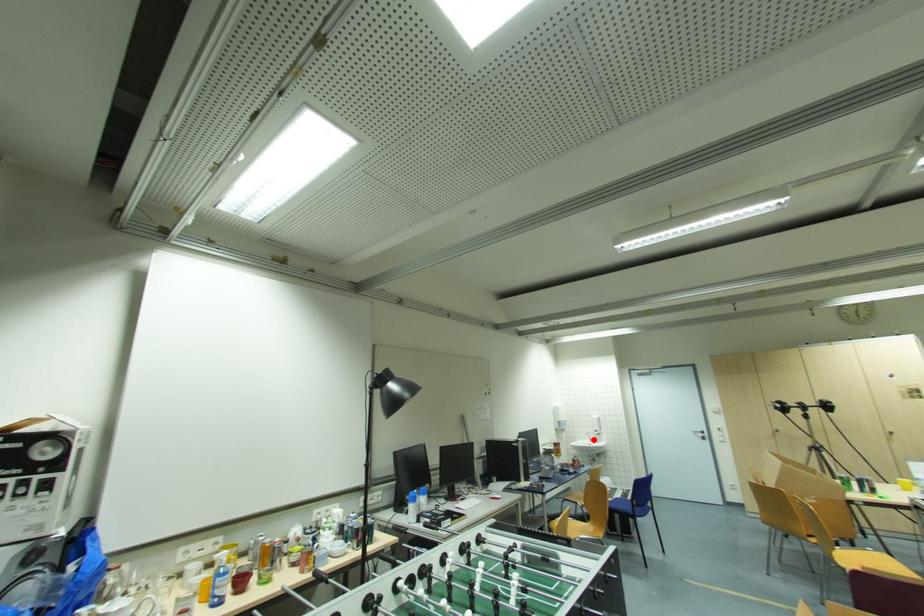
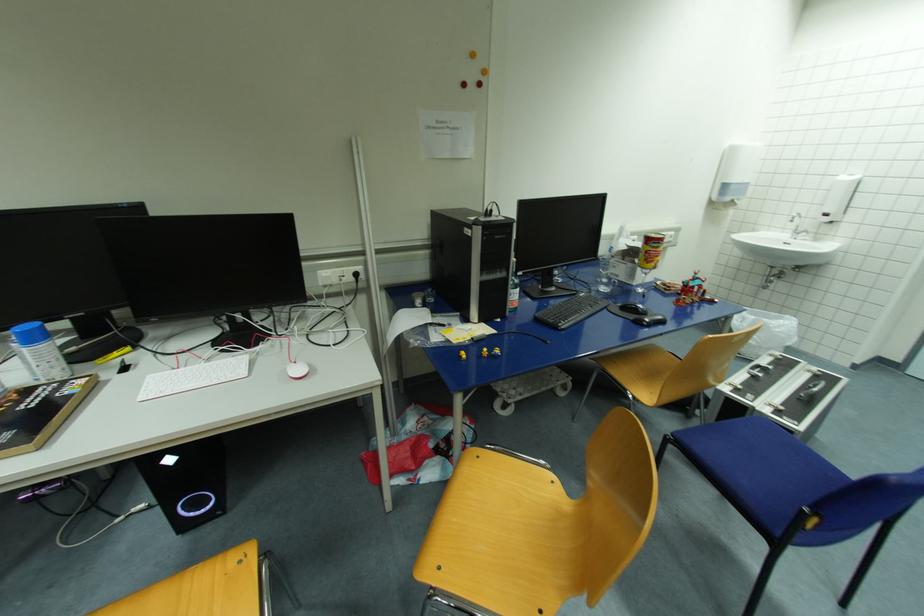
Question: I am providing you with two images of the same scene from different viewpoints. Given a red point in image1, look at the same physical point in image2. Is it:

Choices:
 (A) Closer to the viewpoint
 (B) Farther from the viewpoint

Answer: (A)